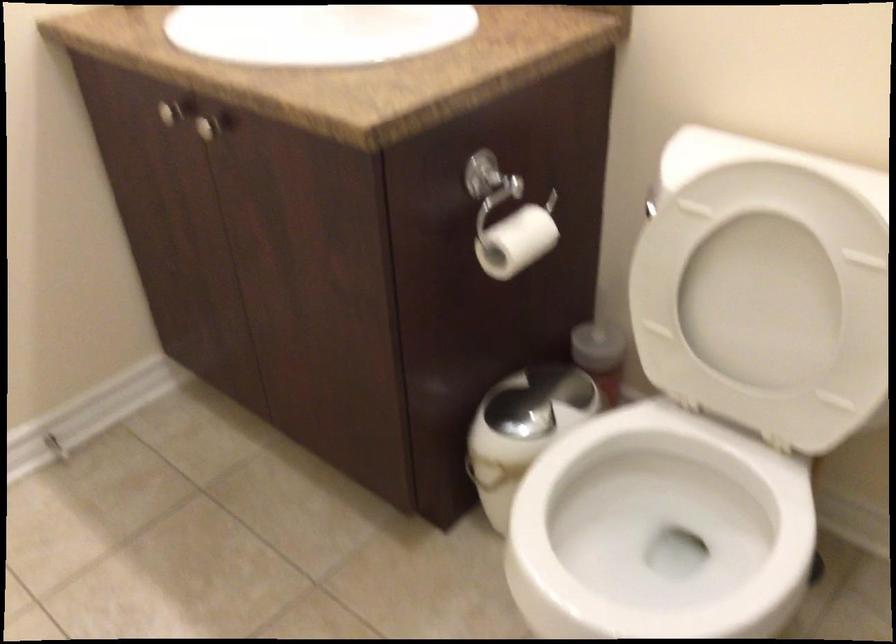
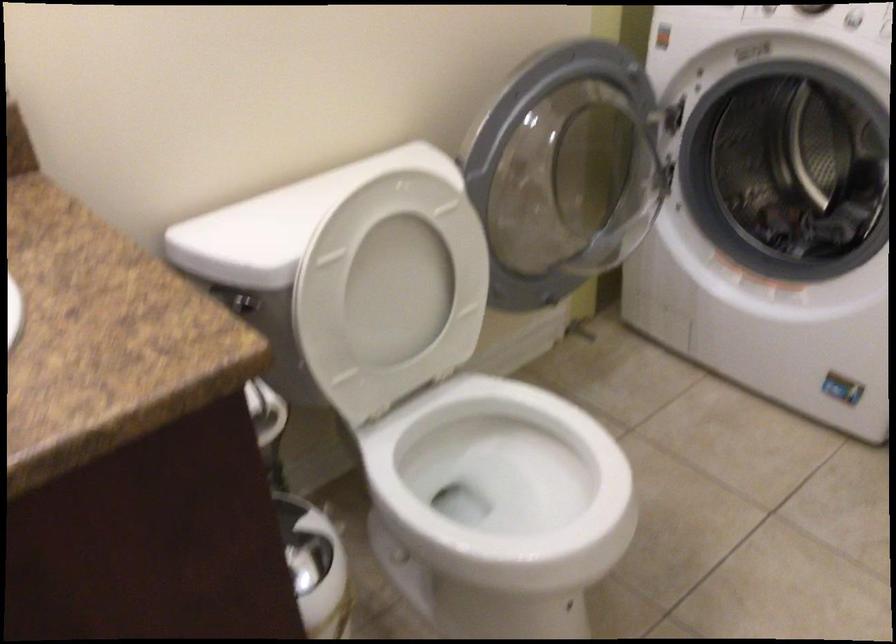
Based on the continuous images, in which direction is the camera rotating?

The camera rotated toward right-down.